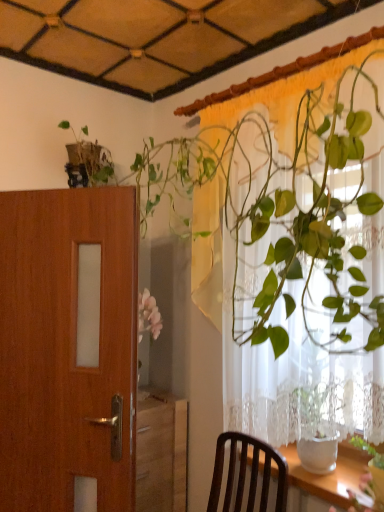
Question: Would you say wooden door at left contains green glossy plant at upper right?

Choices:
 (A) yes
 (B) no

Answer: (B)

Question: Are wooden door at left and green glossy plant at upper right making contact?

Choices:
 (A) yes
 (B) no

Answer: (B)

Question: Considering the relative positions of wooden door at left and green glossy plant at upper right in the image provided, is wooden door at left to the left of green glossy plant at upper right from the viewer's perspective?

Choices:
 (A) no
 (B) yes

Answer: (B)

Question: From the image's perspective, does wooden door at left appear higher than green glossy plant at upper right?

Choices:
 (A) yes
 (B) no

Answer: (B)

Question: Is wooden door at left taller than green glossy plant at upper right?

Choices:
 (A) yes
 (B) no

Answer: (B)

Question: Considering the relative sizes of wooden door at left and green glossy plant at upper right in the image provided, is wooden door at left bigger than green glossy plant at upper right?

Choices:
 (A) yes
 (B) no

Answer: (B)

Question: Would you say green leafy plant at upper right is part of wooden door at left's contents?

Choices:
 (A) no
 (B) yes

Answer: (A)

Question: Considering the relative sizes of wooden door at left and green leafy plant at upper right in the image provided, is wooden door at left smaller than green leafy plant at upper right?

Choices:
 (A) yes
 (B) no

Answer: (A)

Question: From the image's perspective, would you say wooden door at left is shown under green leafy plant at upper right?

Choices:
 (A) yes
 (B) no

Answer: (A)

Question: From a real-world perspective, is wooden door at left located beneath green leafy plant at upper right?

Choices:
 (A) yes
 (B) no

Answer: (A)

Question: From a real-world perspective, is wooden door at left physically above green leafy plant at upper right?

Choices:
 (A) no
 (B) yes

Answer: (A)

Question: Is wooden door at left at the right side of green leafy plant at upper right?

Choices:
 (A) no
 (B) yes

Answer: (A)

Question: Is green leafy plant at upper right bigger than green glossy plant at upper right?

Choices:
 (A) yes
 (B) no

Answer: (B)